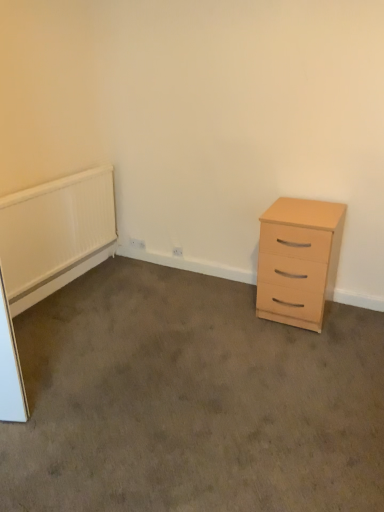
Question: Considering the relative sizes of light wood drawer at right and white textured radiator at left in the image provided, is light wood drawer at right taller than white textured radiator at left?

Choices:
 (A) no
 (B) yes

Answer: (A)

Question: Does light wood drawer at right come in front of white textured radiator at left?

Choices:
 (A) no
 (B) yes

Answer: (B)

Question: Does light wood drawer at right have a larger size compared to white textured radiator at left?

Choices:
 (A) yes
 (B) no

Answer: (A)

Question: Are light wood drawer at right and white textured radiator at left far apart?

Choices:
 (A) yes
 (B) no

Answer: (B)

Question: From the image's perspective, is light wood drawer at right located beneath white textured radiator at left?

Choices:
 (A) no
 (B) yes

Answer: (B)

Question: Is light wood drawer at right facing towards white textured radiator at left?

Choices:
 (A) yes
 (B) no

Answer: (B)

Question: Is white textured radiator at left next to light wood drawer at right and touching it?

Choices:
 (A) yes
 (B) no

Answer: (B)

Question: Can you confirm if white textured radiator at left is wider than light wood drawer at right?

Choices:
 (A) yes
 (B) no

Answer: (B)

Question: Is white textured radiator at left positioned with its back to light wood drawer at right?

Choices:
 (A) no
 (B) yes

Answer: (A)

Question: From the image's perspective, is white textured radiator at left below light wood drawer at right?

Choices:
 (A) yes
 (B) no

Answer: (B)

Question: Is there a large distance between white textured radiator at left and light wood drawer at right?

Choices:
 (A) no
 (B) yes

Answer: (A)

Question: Is white textured radiator at left at the right side of light wood drawer at right?

Choices:
 (A) yes
 (B) no

Answer: (B)

Question: Would you say light wood/finish chest of drawers at right is outside light wood drawer at right?

Choices:
 (A) no
 (B) yes

Answer: (B)